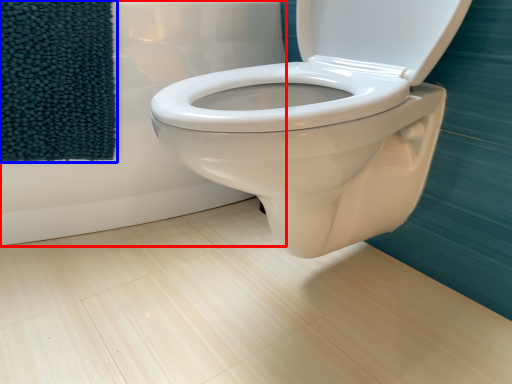
Question: Which object is further to the camera taking this photo, bath (highlighted by a red box) or beach towel (highlighted by a blue box)?

Choices:
 (A) bath
 (B) beach towel

Answer: (B)